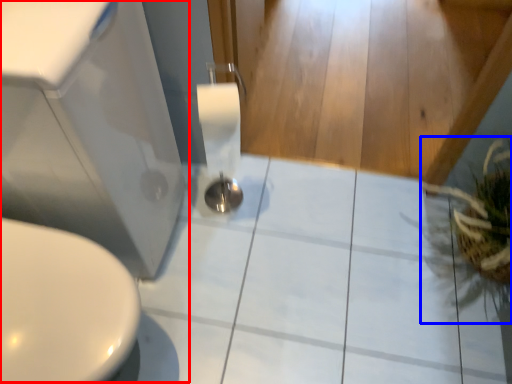
Question: Which point is closer to the camera, sink (highlighted by a red box) or plant (highlighted by a blue box)?

Choices:
 (A) sink
 (B) plant

Answer: (A)